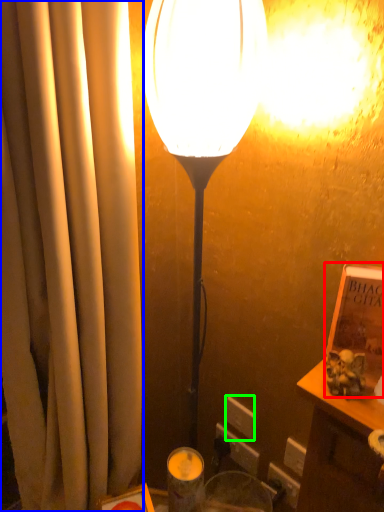
Question: Estimate the real-world distances between objects in this image. Which object is farther from book (highlighted by a red box), curtain (highlighted by a blue box) or electric outlet (highlighted by a green box)?

Choices:
 (A) curtain
 (B) electric outlet

Answer: (B)